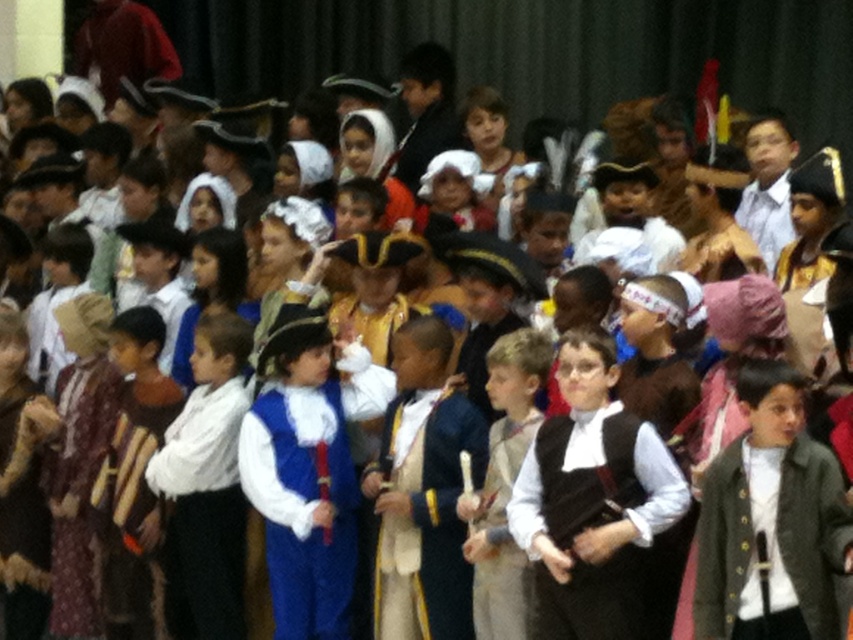
Is point (202, 314) positioned before point (508, 362)?

That is False.

Can you confirm if white cotton shirt at center is thinner than light brown fabric vest at center?

Incorrect, white cotton shirt at center's width is not less than light brown fabric vest at center's.

Which is in front, point (231, 545) or point (532, 396)?

Point (532, 396) is in front.

You are a GUI agent. You are given a task and a screenshot of the screen. Output one action in this format:
    pyautogui.click(x=<x>, y=<y>)
    Task: Click on the white cotton shirt at center
    
    Given the screenshot: What is the action you would take?
    pyautogui.click(x=209, y=477)

Who is taller, velvet blue coat at center or light brown fabric vest at center?

velvet blue coat at center

Between velvet blue coat at center and light brown fabric vest at center, which one appears on the right side from the viewer's perspective?

Positioned to the right is light brown fabric vest at center.

Identify the location of velvet blue coat at center. Image resolution: width=853 pixels, height=640 pixels. (422, 492).

Is blue velvet vest at center positioned behind velvet blue coat at center?

Yes.

Which is behind, point (300, 333) or point (372, 632)?

The point (300, 333) is behind.

Is point (328, 468) in front of point (378, 490)?

No.

You are a GUI agent. You are given a task and a screenshot of the screen. Output one action in this format:
    pyautogui.click(x=<x>, y=<y>)
    Task: Click on the blue velvet vest at center
    
    Given the screenshot: What is the action you would take?
    pyautogui.click(x=309, y=468)